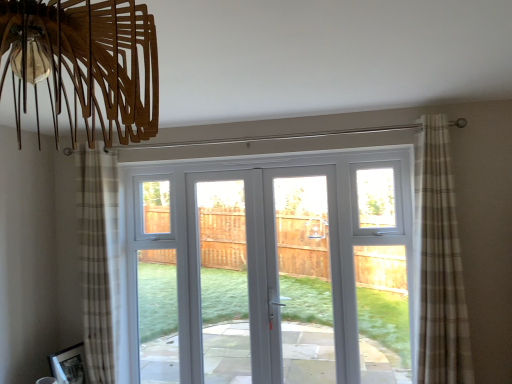
Question: From a real-world perspective, is beige plaid curtain at right, positioned as the second curtain in left-to-right order, over beige plaid curtain at left, the 1th curtain positioned from the back?

Choices:
 (A) no
 (B) yes

Answer: (B)

Question: From a real-world perspective, is beige plaid curtain at right, arranged as the 2th curtain when viewed from the back, beneath beige plaid curtain at left, the 2th curtain viewed from the front?

Choices:
 (A) no
 (B) yes

Answer: (A)

Question: From the image's perspective, is beige plaid curtain at right, which is counted as the first curtain, starting from the right, on beige plaid curtain at left, which ranks as the 2th curtain in right-to-left order?

Choices:
 (A) yes
 (B) no

Answer: (A)

Question: Is beige plaid curtain at right, arranged as the 2th curtain when viewed from the back, positioned with its back to beige plaid curtain at left, the 1th curtain positioned from the back?

Choices:
 (A) yes
 (B) no

Answer: (B)

Question: Does beige plaid curtain at right, which is counted as the first curtain, starting from the right, have a greater width compared to beige plaid curtain at left, the 2th curtain viewed from the front?

Choices:
 (A) yes
 (B) no

Answer: (B)

Question: From the image's perspective, is beige plaid curtain at right, acting as the first curtain starting from the front, beneath beige plaid curtain at left, the 1th curtain positioned from the back?

Choices:
 (A) yes
 (B) no

Answer: (B)

Question: Is beige plaid curtain at left, which ranks as the 2th curtain in right-to-left order, at the left side of beige plaid curtain at right, positioned as the second curtain in left-to-right order?

Choices:
 (A) yes
 (B) no

Answer: (A)

Question: From the image's perspective, would you say beige plaid curtain at left, the 2th curtain viewed from the front, is positioned over beige plaid curtain at right, acting as the first curtain starting from the front?

Choices:
 (A) yes
 (B) no

Answer: (B)

Question: Is beige plaid curtain at left, the 1th curtain positioned from the back, next to beige plaid curtain at right, arranged as the 2th curtain when viewed from the back?

Choices:
 (A) yes
 (B) no

Answer: (B)

Question: Can you confirm if beige plaid curtain at left, the 1th curtain positioned from the back, is bigger than beige plaid curtain at right, positioned as the second curtain in left-to-right order?

Choices:
 (A) no
 (B) yes

Answer: (A)

Question: Would you say beige plaid curtain at left, the first curtain positioned from the left, is a long distance from beige plaid curtain at right, positioned as the second curtain in left-to-right order?

Choices:
 (A) yes
 (B) no

Answer: (A)

Question: Considering the relative positions of beige plaid curtain at left, the 2th curtain viewed from the front, and beige plaid curtain at right, acting as the first curtain starting from the front, in the image provided, is beige plaid curtain at left, the 2th curtain viewed from the front, behind beige plaid curtain at right, acting as the first curtain starting from the front,?

Choices:
 (A) yes
 (B) no

Answer: (A)

Question: From a real-world perspective, does white glossy door at center stand above beige plaid curtain at right, which is counted as the first curtain, starting from the right?

Choices:
 (A) yes
 (B) no

Answer: (B)